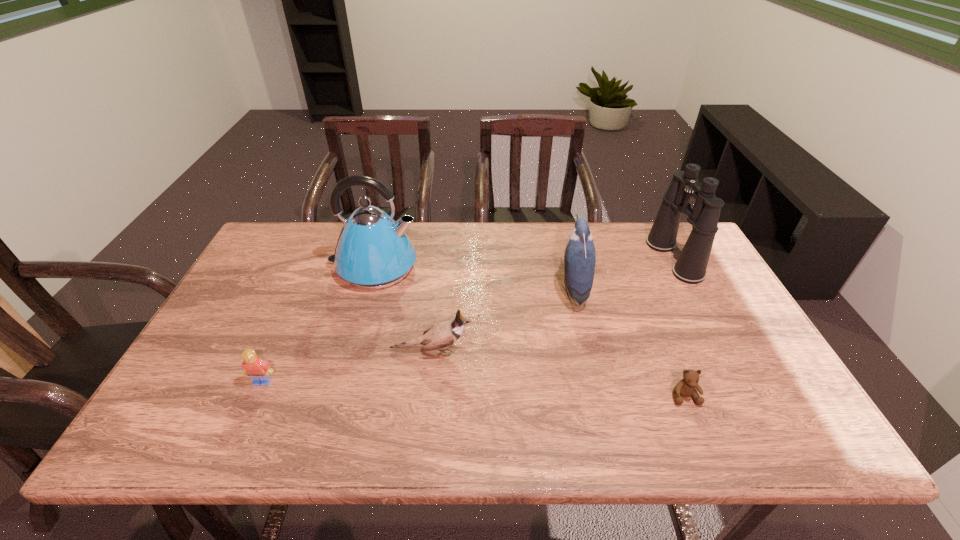
The width and height of the screenshot is (960, 540). In order to click on kettle in this screenshot , I will do `click(373, 251)`.

Where is `the rightmost object`? The width and height of the screenshot is (960, 540). the rightmost object is located at coordinates (691, 266).

Identify the location of the right bird. Image resolution: width=960 pixels, height=540 pixels. (580, 254).

Where is `the fourth shortest object`? the fourth shortest object is located at coordinates (580, 254).

The image size is (960, 540). What are the coordinates of `the left bird` in the screenshot? It's located at (440, 335).

Where is `the third nearest object`? The image size is (960, 540). the third nearest object is located at coordinates (440, 335).

At what (x,y) coordinates should I click in order to perform the action: click on Lego. Please return your answer as a coordinate pair (x, y). The height and width of the screenshot is (540, 960). Looking at the image, I should click on (259, 370).

Identify the location of the leftmost object. (259, 370).

You are a GUI agent. You are given a task and a screenshot of the screen. Output one action in this format:
    pyautogui.click(x=<x>, y=<y>)
    Task: Click on the second object from right to left
    This screenshot has width=960, height=540.
    Given the screenshot: What is the action you would take?
    pyautogui.click(x=686, y=387)

Locate an element on the screen. This screenshot has width=960, height=540. the shortest object is located at coordinates (686, 387).